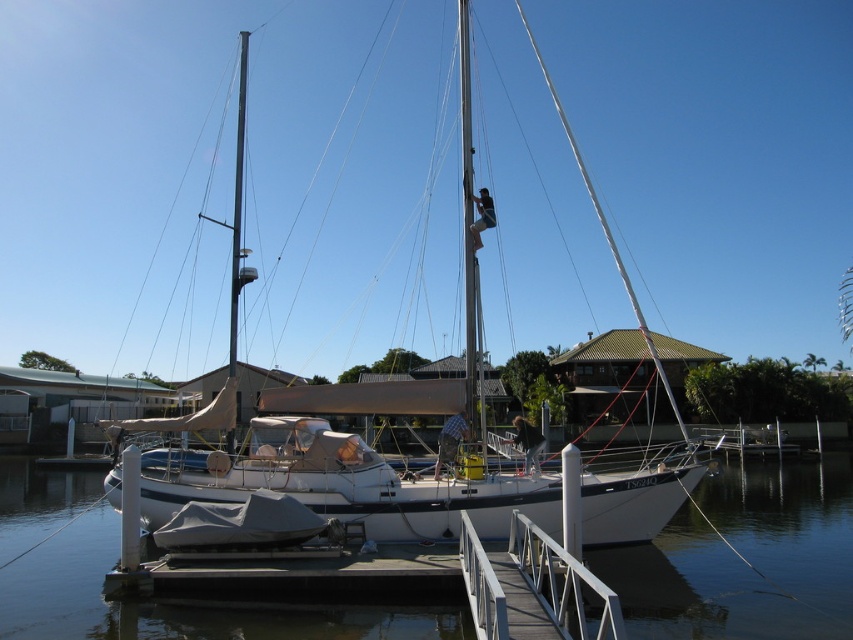
Question: Which of the following is the farthest from the observer?

Choices:
 (A) white metal/rail at center
 (B) clear water at dock center
 (C) white matte sailboat at center

Answer: (C)

Question: Which of the following is the farthest from the observer?

Choices:
 (A) (473, 588)
 (B) (354, 390)
 (C) (656, 589)

Answer: (B)

Question: Can you confirm if clear water at dock center is positioned above white metal/rail at center?

Choices:
 (A) no
 (B) yes

Answer: (A)

Question: Which object appears closest to the camera in this image?

Choices:
 (A) white matte sailboat at center
 (B) clear water at dock center
 (C) white metal/rail at center

Answer: (C)

Question: Does clear water at dock center appear on the left side of white metal/rail at center?

Choices:
 (A) no
 (B) yes

Answer: (A)

Question: Does clear water at dock center have a greater width compared to white metal/rail at center?

Choices:
 (A) no
 (B) yes

Answer: (B)